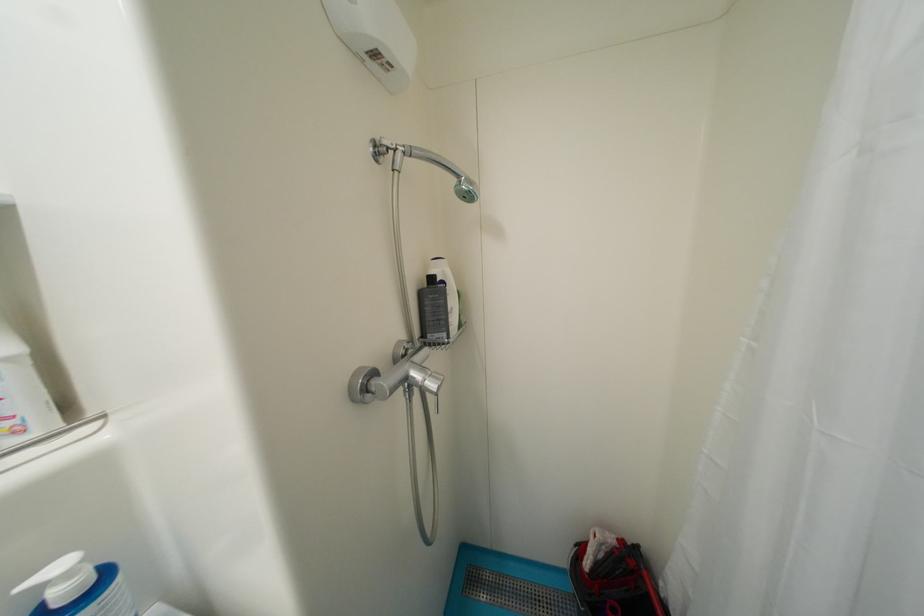
Where is `white pump dispenser`? The width and height of the screenshot is (924, 616). white pump dispenser is located at coordinates (439, 305).